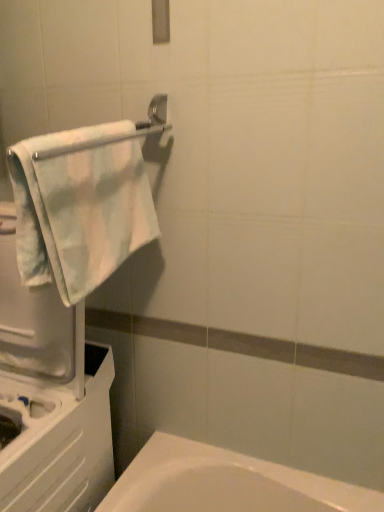
Question: Is light blue plush towel at left behind silver metallic towel bar at upper left?

Choices:
 (A) yes
 (B) no

Answer: (A)

Question: From the image's perspective, is light blue plush towel at left below silver metallic towel bar at upper left?

Choices:
 (A) yes
 (B) no

Answer: (A)

Question: Is light blue plush towel at left turned away from silver metallic towel bar at upper left?

Choices:
 (A) no
 (B) yes

Answer: (A)

Question: Is light blue plush towel at left not close to silver metallic towel bar at upper left?

Choices:
 (A) no
 (B) yes

Answer: (A)

Question: Considering the relative sizes of light blue plush towel at left and silver metallic towel bar at upper left in the image provided, is light blue plush towel at left shorter than silver metallic towel bar at upper left?

Choices:
 (A) no
 (B) yes

Answer: (A)

Question: From the image's perspective, does light blue plush towel at left appear higher than silver metallic towel bar at upper left?

Choices:
 (A) no
 (B) yes

Answer: (A)

Question: Is silver metallic towel bar at upper left in front of light blue plush towel at left?

Choices:
 (A) yes
 (B) no

Answer: (A)

Question: From the image's perspective, is silver metallic towel bar at upper left located beneath light blue plush towel at left?

Choices:
 (A) no
 (B) yes

Answer: (A)

Question: From a real-world perspective, is silver metallic towel bar at upper left located beneath light blue plush towel at left?

Choices:
 (A) no
 (B) yes

Answer: (A)

Question: Is silver metallic towel bar at upper left at the right side of light blue plush towel at left?

Choices:
 (A) no
 (B) yes

Answer: (B)

Question: Is silver metallic towel bar at upper left positioned beyond the bounds of light blue plush towel at left?

Choices:
 (A) yes
 (B) no

Answer: (B)

Question: Does silver metallic towel bar at upper left have a lesser height compared to light blue plush towel at left?

Choices:
 (A) yes
 (B) no

Answer: (A)

Question: Which is correct: silver metallic towel bar at upper left is inside light blue plush towel at left, or outside of it?

Choices:
 (A) inside
 (B) outside

Answer: (A)